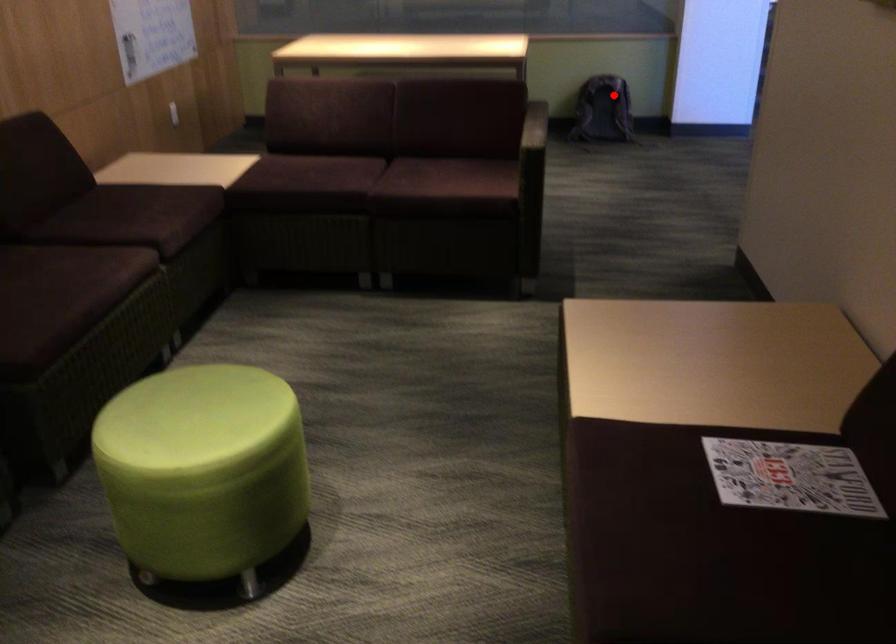
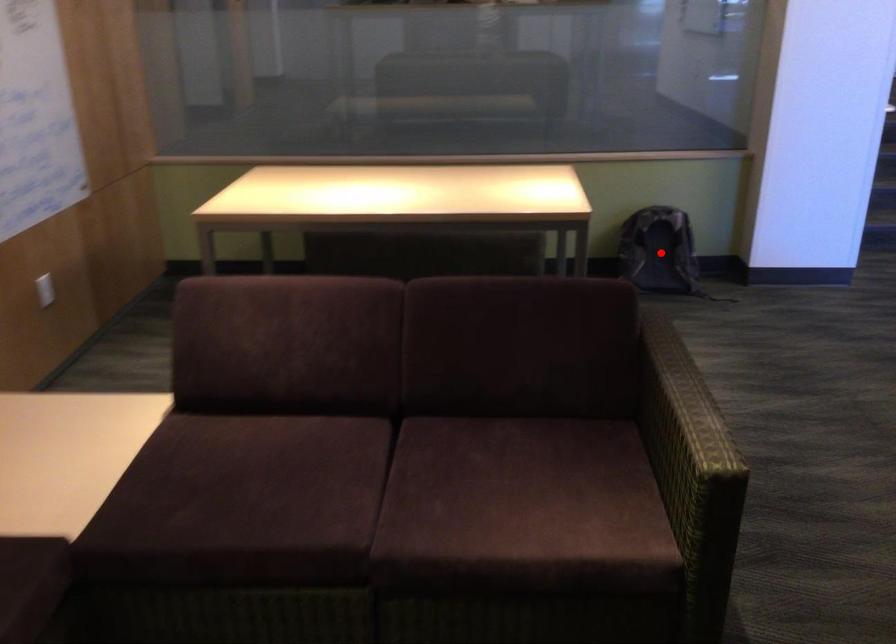
I am providing you with two images of the same scene from different viewpoints. A red point is marked on the first image and another point is marked on the second image. Do the highlighted points in image1 and image2 indicate the same real-world spot?

Yes